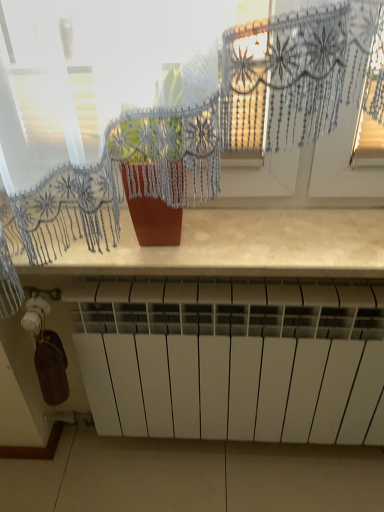
Identify the location of matte brown countertop at center. (242, 245).

What is the approximate height of white matte radiator at lower center?

The height of white matte radiator at lower center is 59.53 centimeters.

Where is `matte brown countertop at center`? The width and height of the screenshot is (384, 512). matte brown countertop at center is located at coordinates (242, 245).

Is point (357, 267) closer or farther from the camera than point (124, 84)?

Point (357, 267) is positioned farther from the camera compared to point (124, 84).

Is matte brown countertop at center facing away from transparent lace curtain at upper center?

No, transparent lace curtain at upper center is not at the back of matte brown countertop at center.

Is matte brown countertop at center taller than transparent lace curtain at upper center?

No.

At what (x,y) coordinates should I click in order to perform the action: click on counter top that appears behind the transparent lace curtain at upper center. Please return your answer as a coordinate pair (x, y). The height and width of the screenshot is (512, 384). Looking at the image, I should click on (242, 245).

Based on the photo, between white matte radiator at lower center and matte brown countertop at center, which one has more height?

With more height is white matte radiator at lower center.

Between white matte radiator at lower center and matte brown countertop at center, which one has smaller width?

With smaller width is white matte radiator at lower center.

Is white matte radiator at lower center spatially inside matte brown countertop at center, or outside of it?

white matte radiator at lower center exists outside the volume of matte brown countertop at center.

Is point (369, 305) closer or farther from the camera than point (236, 265)?

Point (369, 305) is farther from the camera than point (236, 265).

Between white matte radiator at lower center and transparent lace curtain at upper center, which one has larger width?

white matte radiator at lower center.

Is white matte radiator at lower center facing towards transparent lace curtain at upper center?

No.

Which is closer to the camera, (266,421) or (154,68)?

The point (154,68) is closer to the camera.

From the image's perspective, which object appears higher, transparent lace curtain at upper center or matte brown countertop at center?

transparent lace curtain at upper center.

Which of these two, transparent lace curtain at upper center or matte brown countertop at center, stands shorter?

With less height is matte brown countertop at center.

Based on the photo, is transparent lace curtain at upper center not close to matte brown countertop at center?

They are positioned close to each other.

How much distance is there between transparent lace curtain at upper center and matte brown countertop at center?

transparent lace curtain at upper center and matte brown countertop at center are 4.43 inches apart from each other.

Does matte brown countertop at center have a lesser height compared to white matte radiator at lower center?

Yes.

Is matte brown countertop at center far from white matte radiator at lower center?

matte brown countertop at center is actually quite close to white matte radiator at lower center.

Which is more to the left, matte brown countertop at center or white matte radiator at lower center?

matte brown countertop at center.

Is transparent lace curtain at upper center bigger than white matte radiator at lower center?

Actually, transparent lace curtain at upper center might be smaller than white matte radiator at lower center.

Could you measure the distance between transparent lace curtain at upper center and white matte radiator at lower center?

transparent lace curtain at upper center and white matte radiator at lower center are 14.65 inches apart.

Between transparent lace curtain at upper center and white matte radiator at lower center, which one appears on the right side from the viewer's perspective?

From the viewer's perspective, white matte radiator at lower center appears more on the right side.

In the scene shown: Considering the sizes of objects transparent lace curtain at upper center and white matte radiator at lower center in the image provided, who is taller, transparent lace curtain at upper center or white matte radiator at lower center?

white matte radiator at lower center is taller.

Identify the location of window in front of the matte brown countertop at center. The image size is (384, 512). (198, 142).

You are a GUI agent. You are given a task and a screenshot of the screen. Output one action in this format:
    pyautogui.click(x=<x>, y=<y>)
    Task: Click on the counter top on the left side of white matte radiator at lower center
    Image resolution: width=384 pixels, height=512 pixels.
    Given the screenshot: What is the action you would take?
    pyautogui.click(x=242, y=245)

Considering their positions, is white matte radiator at lower center positioned closer to transparent lace curtain at upper center than matte brown countertop at center?

matte brown countertop at center.

From the image, which object appears to be nearer to white matte radiator at lower center, transparent lace curtain at upper center or matte brown countertop at center?

The object closer to white matte radiator at lower center is matte brown countertop at center.

From the image, which object appears to be farther from white matte radiator at lower center, matte brown countertop at center or transparent lace curtain at upper center?

transparent lace curtain at upper center lies further to white matte radiator at lower center than the other object.

Which object lies further to the anchor point matte brown countertop at center, white matte radiator at lower center or transparent lace curtain at upper center?

white matte radiator at lower center is positioned further to the anchor matte brown countertop at center.

Considering their positions, is matte brown countertop at center positioned further to transparent lace curtain at upper center than white matte radiator at lower center?

white matte radiator at lower center is further to transparent lace curtain at upper center.

Looking at the image, which one is located further to matte brown countertop at center, transparent lace curtain at upper center or white matte radiator at lower center?

white matte radiator at lower center.

At what (x,y) coordinates should I click in order to perform the action: click on counter top between transparent lace curtain at upper center and white matte radiator at lower center in the vertical direction. Please return your answer as a coordinate pair (x, y). The image size is (384, 512). Looking at the image, I should click on (242, 245).